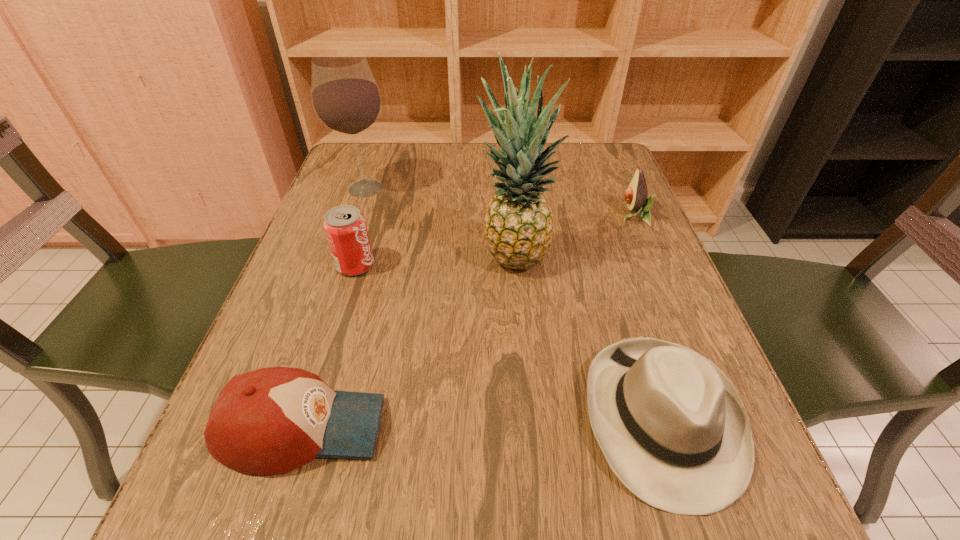
Locate an element on the screen. vacant area located 0.330m on the seed side of the avocado is located at coordinates (476, 216).

You are a GUI agent. You are given a task and a screenshot of the screen. Output one action in this format:
    pyautogui.click(x=<x>, y=<y>)
    Task: Click on the vacant space situated 0.290m on the seed side of the avocado
    
    Given the screenshot: What is the action you would take?
    pyautogui.click(x=493, y=216)

At what (x,y) coordinates should I click in order to perform the action: click on free space located on the seed side of the avocado. Please return your answer as a coordinate pair (x, y). Looking at the image, I should click on (546, 216).

Where is `free space located 0.360m on the front-facing side of the baseball cap`? free space located 0.360m on the front-facing side of the baseball cap is located at coordinates (633, 428).

The width and height of the screenshot is (960, 540). Find the location of `object situated at the far edge`. object situated at the far edge is located at coordinates (346, 99).

Where is `object present at the near edge`? The image size is (960, 540). object present at the near edge is located at coordinates (671, 425).

I want to click on alcohol that is positioned at the left edge, so click(x=346, y=99).

This screenshot has width=960, height=540. What are the coordinates of `soda can located in the left edge section of the desktop` in the screenshot? It's located at (345, 227).

Locate an element on the screen. The height and width of the screenshot is (540, 960). baseball cap present at the left edge is located at coordinates (273, 420).

This screenshot has width=960, height=540. What are the coordinates of `avocado at the right edge` in the screenshot? It's located at (636, 195).